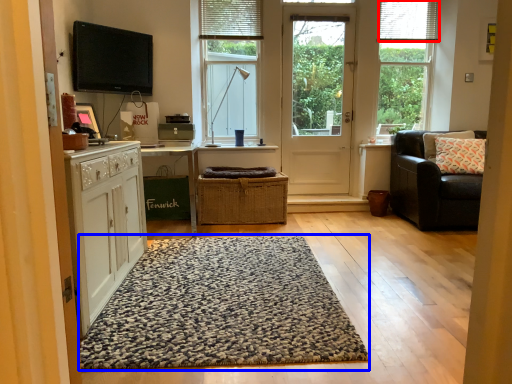
Question: Among these objects, which one is farthest to the camera, blind (highlighted by a red box) or doormat (highlighted by a blue box)?

Choices:
 (A) blind
 (B) doormat

Answer: (A)